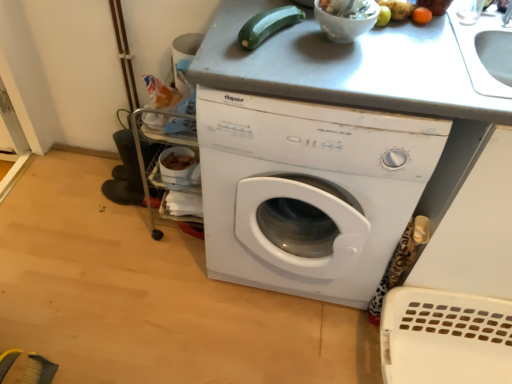
This screenshot has width=512, height=384. Identify the location of free location to the left of white plastic washing machine at center. (134, 283).